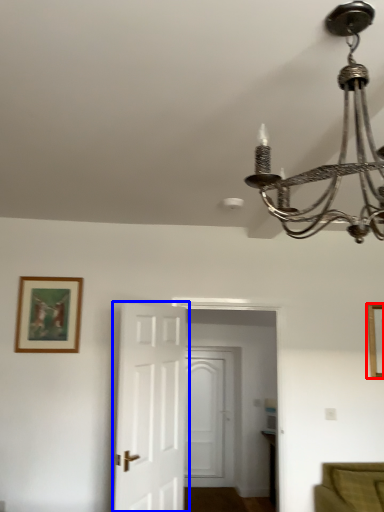
Question: Which object appears closest to the camera in this image, picture frame (highlighted by a red box) or door (highlighted by a blue box)?

Choices:
 (A) picture frame
 (B) door

Answer: (B)